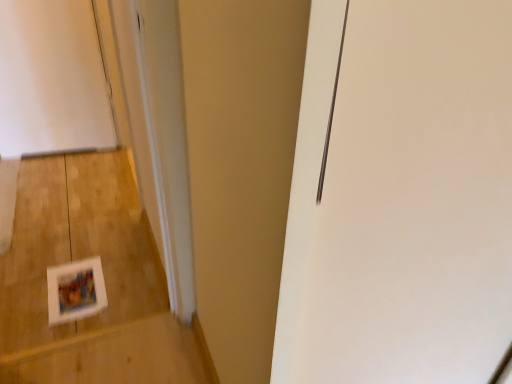
Question: Is white matte frame at lower left inside the boundaries of matte white postcard at lower left, or outside?

Choices:
 (A) inside
 (B) outside

Answer: (B)

Question: Is white matte frame at lower left to the left or to the right of matte white postcard at lower left in the image?

Choices:
 (A) left
 (B) right

Answer: (A)

Question: From a real-world perspective, relative to matte white postcard at lower left, is white matte frame at lower left vertically above or below?

Choices:
 (A) above
 (B) below

Answer: (B)

Question: From the image's perspective, is matte white postcard at lower left located above or below white matte frame at lower left?

Choices:
 (A) below
 (B) above

Answer: (A)

Question: Based on their positions, is matte white postcard at lower left located to the left or right of white matte frame at lower left?

Choices:
 (A) right
 (B) left

Answer: (A)

Question: Based on their sizes in the image, would you say matte white postcard at lower left is bigger or smaller than white matte frame at lower left?

Choices:
 (A) big
 (B) small

Answer: (B)

Question: In the image, is matte white postcard at lower left positioned in front of or behind white matte frame at lower left?

Choices:
 (A) front
 (B) behind

Answer: (B)